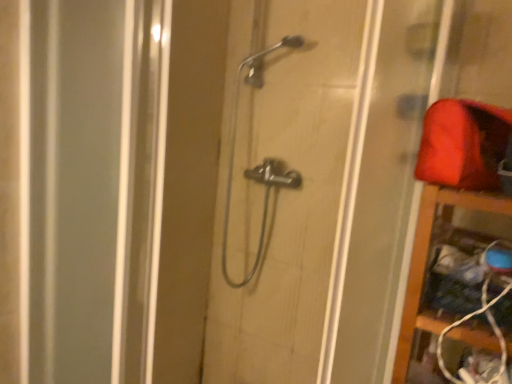
Question: Are wooden shelf at right and metallic showerhead at center making contact?

Choices:
 (A) no
 (B) yes

Answer: (A)

Question: Is the depth of wooden shelf at right greater than that of metallic showerhead at center?

Choices:
 (A) yes
 (B) no

Answer: (A)

Question: Would you consider wooden shelf at right to be distant from metallic showerhead at center?

Choices:
 (A) no
 (B) yes

Answer: (A)

Question: Can you confirm if wooden shelf at right is taller than metallic showerhead at center?

Choices:
 (A) yes
 (B) no

Answer: (B)

Question: Does wooden shelf at right have a lesser width compared to metallic showerhead at center?

Choices:
 (A) no
 (B) yes

Answer: (B)

Question: Considering the positions of metallic showerhead at center and matte red fabric at upper right in the image, is metallic showerhead at center bigger or smaller than matte red fabric at upper right?

Choices:
 (A) big
 (B) small

Answer: (A)

Question: Which is correct: metallic showerhead at center is inside matte red fabric at upper right, or outside of it?

Choices:
 (A) outside
 (B) inside

Answer: (A)

Question: In the image, is metallic showerhead at center positioned in front of or behind matte red fabric at upper right?

Choices:
 (A) behind
 (B) front

Answer: (B)

Question: In terms of width, does metallic showerhead at center look wider or thinner when compared to matte red fabric at upper right?

Choices:
 (A) wide
 (B) thin

Answer: (A)

Question: In the image, is polished chrome shower at center positioned in front of or behind wooden shelf at right?

Choices:
 (A) front
 (B) behind

Answer: (B)

Question: In terms of height, does polished chrome shower at center look taller or shorter compared to wooden shelf at right?

Choices:
 (A) short
 (B) tall

Answer: (B)

Question: Choose the correct answer: Is polished chrome shower at center inside wooden shelf at right or outside it?

Choices:
 (A) outside
 (B) inside

Answer: (A)

Question: Visually, is polished chrome shower at center positioned to the left or to the right of wooden shelf at right?

Choices:
 (A) right
 (B) left

Answer: (B)

Question: Is point (478, 208) positioned closer to the camera than point (362, 187)?

Choices:
 (A) closer
 (B) farther

Answer: (B)

Question: In the image, is wooden shelf at right positioned in front of or behind metallic showerhead at center?

Choices:
 (A) front
 (B) behind

Answer: (B)